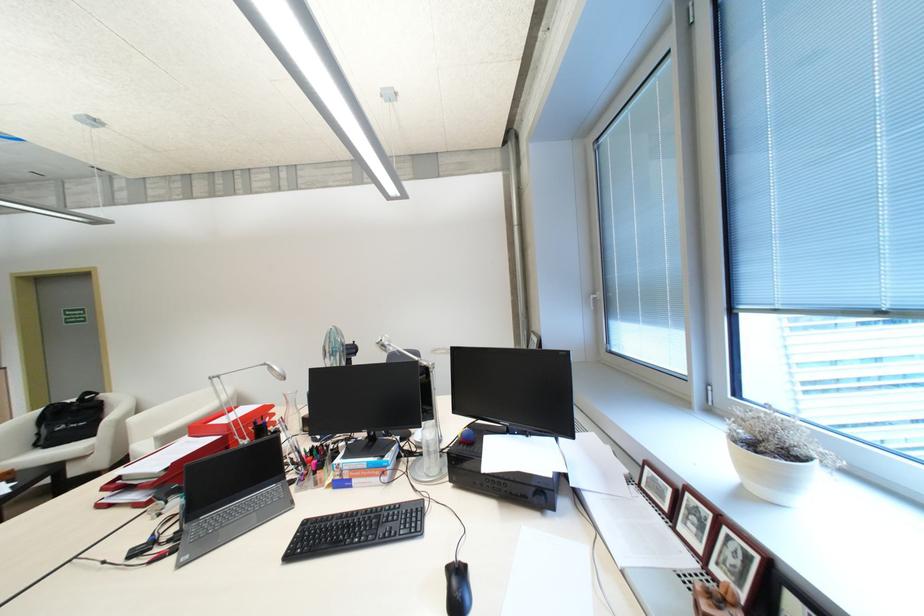
Where would you lift the black tote bag? Please return your answer as a coordinate pair (x, y).

(68, 419)